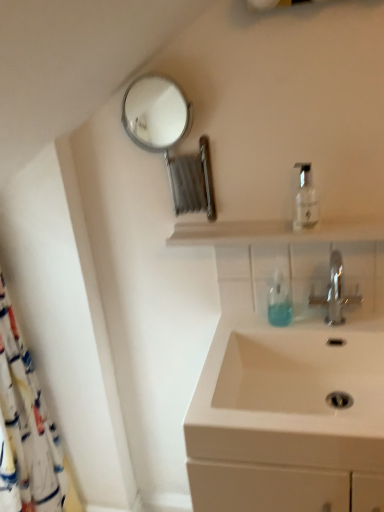
The image size is (384, 512). Find the location of `vacant point to the right of translucent plastic soap dispenser at center`. vacant point to the right of translucent plastic soap dispenser at center is located at coordinates (333, 322).